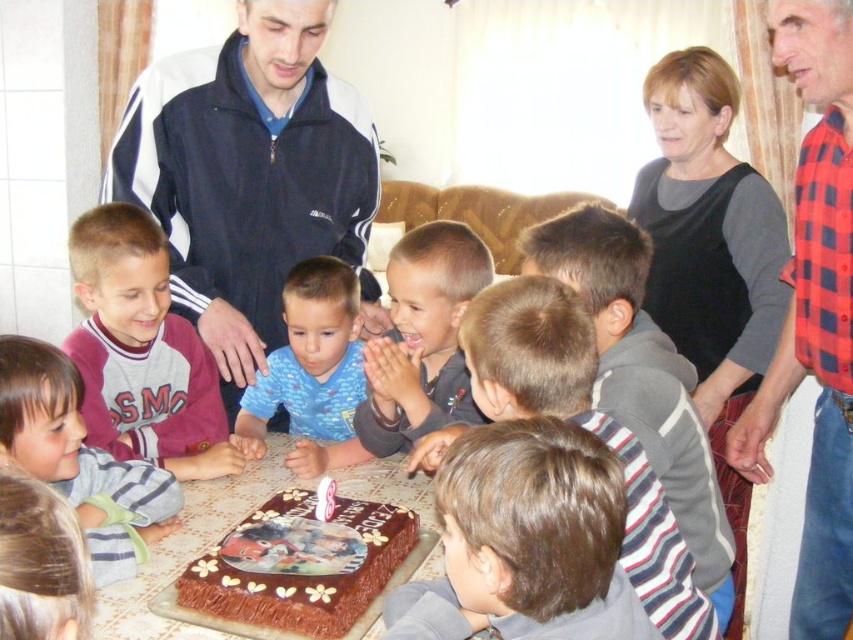
Is brown hair at lower center taller than blue cotton shirt at center?

In fact, brown hair at lower center may be shorter than blue cotton shirt at center.

Who is positioned more to the left, brown hair at lower center or blue cotton shirt at center?

Positioned to the left is blue cotton shirt at center.

Where is `brown hair at lower center`? Image resolution: width=853 pixels, height=640 pixels. brown hair at lower center is located at coordinates (526, 540).

Can you confirm if gray fleece sweatshirt at lower left is thinner than gray fleece shirt at lower left?

Incorrect, gray fleece sweatshirt at lower left's width is not less than gray fleece shirt at lower left's.

Does gray fleece sweatshirt at lower left have a larger size compared to gray fleece shirt at lower left?

Correct, gray fleece sweatshirt at lower left is larger in size than gray fleece shirt at lower left.

Who is more distant from viewer, (151, 243) or (144, 547)?

Positioned behind is point (151, 243).

Locate an element on the screen. The height and width of the screenshot is (640, 853). gray fleece sweatshirt at lower left is located at coordinates (142, 352).

Is gray fleece sweatshirt at lower left closer to the viewer compared to chocolate frosted cake at center?

No, gray fleece sweatshirt at lower left is further to the viewer.

What are the coordinates of `gray fleece sweatshirt at lower left` in the screenshot? It's located at (142, 352).

Which is in front, point (91, 365) or point (286, 436)?

Point (91, 365)

The height and width of the screenshot is (640, 853). I want to click on gray fleece sweatshirt at lower left, so click(x=142, y=352).